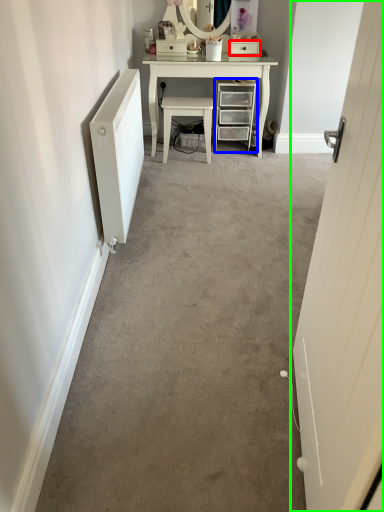
Question: Which is farther away from drawer (highlighted by a red box)? chest of drawers (highlighted by a blue box) or door (highlighted by a green box)?

Choices:
 (A) chest of drawers
 (B) door

Answer: (B)